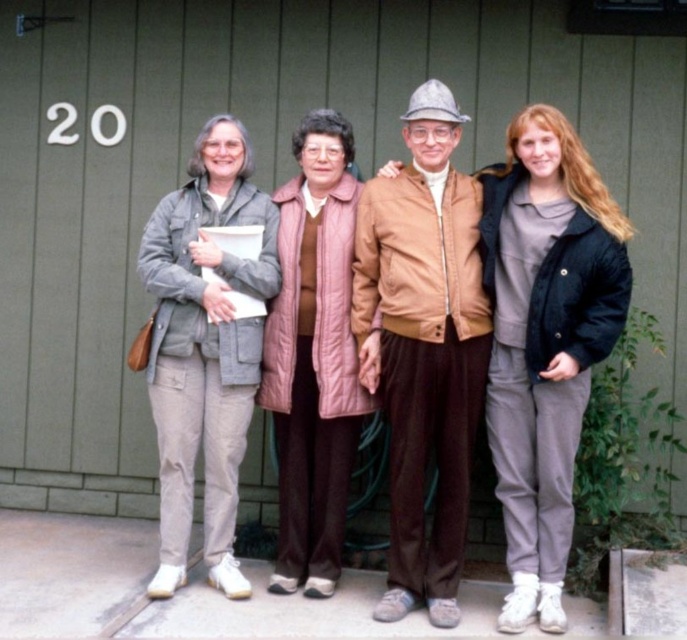
Looking at this image, you are a fashion designer analyzing the clothing items in the scene. Which clothing item, the tan leather jacket at center or the pink quilted vest at center, would you recommend for someone who wants a more voluminous look?

The tan leather jacket at center has a larger size compared to the pink quilted vest at center, so it would be the better choice for a more voluminous look.

From the picture: You are a photographer standing in front of the group. You notice two gray items in the center of the image. Which one is nearer to you, the matte gray jacket at center or the matte gray sweatshirt at center?

The matte gray jacket at center is closer to the viewer than the matte gray sweatshirt at center.

You are a photographer taking a group photo of the two people wearing gray clothing in the center of the image. The matte gray jacket at center and the matte gray sweatshirt at center. You want to ensure both are visible in the frame. Which clothing item should you adjust to make sure the shorter one isn not blocked?

The matte gray sweatshirt at center is shorter than the matte gray jacket at center. To ensure the shorter one isn not blocked, adjust the matte gray sweatshirt at center to a higher position.